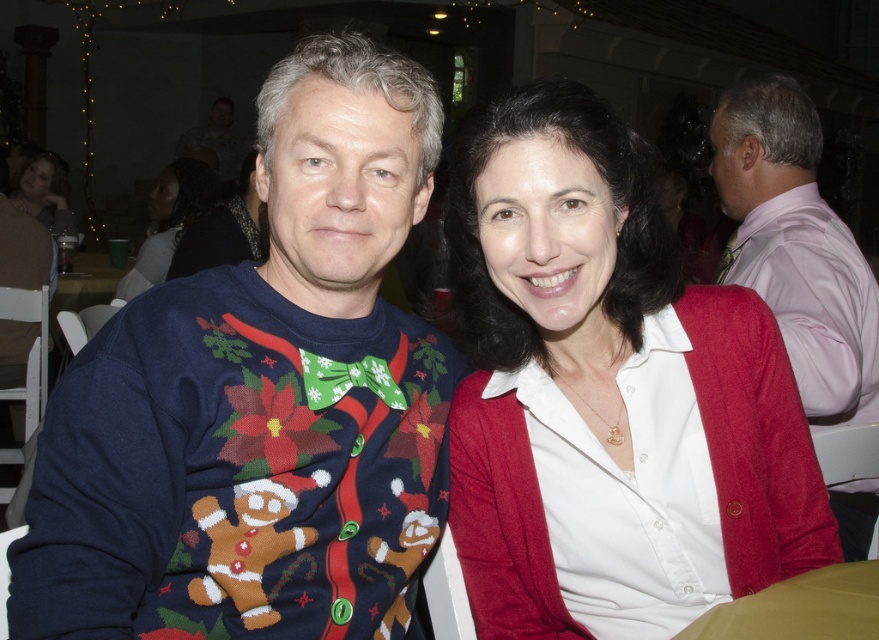
You are a photographer at a holiday event. You need to adjust the camera focus to capture both the pink satin shirt at right and the dark brown hair at upper left. Which object should you focus on first to ensure proper depth of field?

The pink satin shirt at right is much taller than the dark brown hair at upper left, so you should focus on the pink satin shirt at right first to ensure proper depth of field.

You are a photographer at a holiday party and need to adjust the lighting to ensure both the dark brown hair at upper left and the matte black hair at upper left are evenly illuminated. Since one is narrower than the other, which hair should you focus the light on first to account for their size difference?

The dark brown hair at upper left has a lesser width compared to matte black hair at upper left, so you should focus the light on the matte black hair at upper left first because it is wider and may require more even distribution of light to cover its entire area.

From the picture: You are a photographer at a holiday event and need to adjust your camera focus. The pink satin shirt at right and dark brown hair at upper left are both in the frame. Which object takes up more space in the current image?

The dark brown hair at upper left takes up more space in the current image because the pink satin shirt at right occupies less space than dark brown hair at upper left.